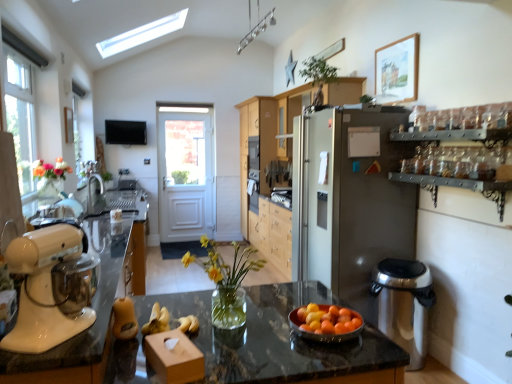
Question: Does white glossy stand mixer at left have a lesser width compared to orange matte bowl at center?

Choices:
 (A) yes
 (B) no

Answer: (B)

Question: Is white glossy stand mixer at left taller than orange matte bowl at center?

Choices:
 (A) yes
 (B) no

Answer: (A)

Question: Is white glossy stand mixer at left completely or partially outside of orange matte bowl at center?

Choices:
 (A) no
 (B) yes

Answer: (B)

Question: Considering the relative sizes of white glossy stand mixer at left and orange matte bowl at center in the image provided, is white glossy stand mixer at left bigger than orange matte bowl at center?

Choices:
 (A) yes
 (B) no

Answer: (A)

Question: From the image's perspective, is white glossy stand mixer at left on top of orange matte bowl at center?

Choices:
 (A) yes
 (B) no

Answer: (A)

Question: Based on their positions, is satin silver coffee machine at right located to the left or right of flat screen tv at upper center?

Choices:
 (A) right
 (B) left

Answer: (A)

Question: From a real-world perspective, is satin silver coffee machine at right physically located above or below flat screen tv at upper center?

Choices:
 (A) above
 (B) below

Answer: (B)

Question: Is point 386,279 positioned closer to the camera than point 109,137?

Choices:
 (A) farther
 (B) closer

Answer: (B)

Question: From their relative heights in the image, would you say satin silver coffee machine at right is taller or shorter than flat screen tv at upper center?

Choices:
 (A) tall
 (B) short

Answer: (A)

Question: From the image's perspective, is matte wood cabinet at center, the 1th cabinetry positioned from the front, above or below light wood cabinetry at center, which is the second cabinetry from front to back?

Choices:
 (A) below
 (B) above

Answer: (B)

Question: From a real-world perspective, relative to light wood cabinetry at center, which is the second cabinetry from front to back, is matte wood cabinet at center, the 1th cabinetry positioned from the front, vertically above or below?

Choices:
 (A) below
 (B) above

Answer: (B)

Question: Does point (290, 109) appear closer or farther from the camera than point (257, 180)?

Choices:
 (A) closer
 (B) farther

Answer: (A)

Question: Considering the relative positions of matte wood cabinet at center, the second cabinetry from the back, and light wood cabinetry at center, which is the second cabinetry from front to back, in the image provided, is matte wood cabinet at center, the second cabinetry from the back, to the left or to the right of light wood cabinetry at center, which is the second cabinetry from front to back,?

Choices:
 (A) right
 (B) left

Answer: (A)

Question: Is satin silver coffee machine at right wider or thinner than green leafy plant at upper center?

Choices:
 (A) wide
 (B) thin

Answer: (A)

Question: From a real-world perspective, is satin silver coffee machine at right above or below green leafy plant at upper center?

Choices:
 (A) above
 (B) below

Answer: (B)